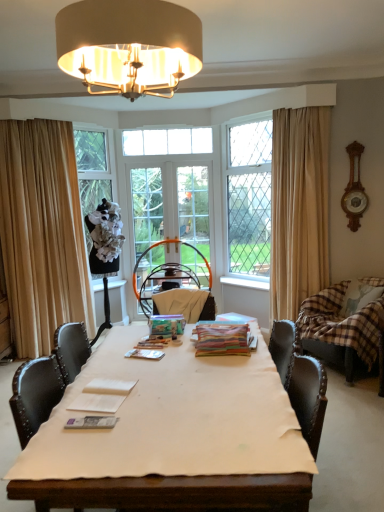
Question: From a real-world perspective, is plaid fabric pillow at right positioned above or below clear glass window at upper center, the second window viewed from the front?

Choices:
 (A) above
 (B) below

Answer: (B)

Question: From the image's perspective, is plaid fabric pillow at right above or below clear glass window at upper center, which is the second window from right to left?

Choices:
 (A) below
 (B) above

Answer: (A)

Question: Which of these objects is positioned closest to the clear glass door at center, placed as the first screen door when sorted from left to right?

Choices:
 (A) white cloth at center
 (B) brown plaid fabric swivel chair at right
 (C) clear glass window at center, the 2th window positioned from the back
 (D) beige fabric curtain at right, acting as the 2th curtain starting from the left
 (E) clear glass screen door at center, positioned as the 2th screen door in left-to-right order

Answer: (E)

Question: Based on their relative distances, which object is nearer to the velvet beige armchair at center?

Choices:
 (A) brown plaid fabric swivel chair at right
 (B) metallic silver magazine at center, positioned as the second magazine in top-to-bottom order
 (C) matte gold chandelier at upper center
 (D) multicolored paper stack at center, the 1th magazine when ordered from top to bottom
 (E) matte white magazine at center, the 3th magazine from the right

Answer: (D)